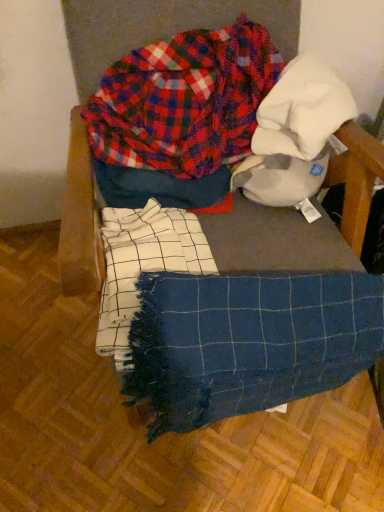
Question: Are plaid fabric at upper center and blue woven blanket at center located far from each other?

Choices:
 (A) yes
 (B) no

Answer: (B)

Question: Is plaid fabric at upper center surrounding blue woven blanket at center?

Choices:
 (A) yes
 (B) no

Answer: (B)

Question: From a real-world perspective, is plaid fabric at upper center beneath blue woven blanket at center?

Choices:
 (A) yes
 (B) no

Answer: (B)

Question: Considering the relative sizes of plaid fabric at upper center and blue woven blanket at center in the image provided, is plaid fabric at upper center shorter than blue woven blanket at center?

Choices:
 (A) yes
 (B) no

Answer: (A)

Question: Can you confirm if plaid fabric at upper center is thinner than blue woven blanket at center?

Choices:
 (A) yes
 (B) no

Answer: (A)

Question: Would you say plaid fabric at upper center is to the left or to the right of blue woven blanket at center in the picture?

Choices:
 (A) left
 (B) right

Answer: (A)

Question: In the image, is plaid fabric at upper center positioned in front of or behind blue woven blanket at center?

Choices:
 (A) behind
 (B) front

Answer: (A)

Question: From the image's perspective, is plaid fabric at upper center positioned above or below blue woven blanket at center?

Choices:
 (A) above
 (B) below

Answer: (A)

Question: Considering the positions of plaid fabric at upper center and blue woven blanket at center in the image, is plaid fabric at upper center wider or thinner than blue woven blanket at center?

Choices:
 (A) thin
 (B) wide

Answer: (A)

Question: Is point (92, 145) closer or farther from the camera than point (354, 359)?

Choices:
 (A) closer
 (B) farther

Answer: (B)

Question: From their relative heights in the image, would you say plaid fabric at upper center is taller or shorter than blue woven blanket at center?

Choices:
 (A) tall
 (B) short

Answer: (B)

Question: From a real-world perspective, is plaid fabric at upper center above or below blue woven blanket at center?

Choices:
 (A) above
 (B) below

Answer: (A)

Question: In the image, is plaid fabric at upper center positioned in front of or behind blue woven blanket at center?

Choices:
 (A) front
 (B) behind

Answer: (B)

Question: In terms of width, does blue woven blanket at center look wider or thinner when compared to blue woven blanket at center?

Choices:
 (A) wide
 (B) thin

Answer: (A)

Question: From the image's perspective, is blue woven blanket at center above or below blue woven blanket at center?

Choices:
 (A) below
 (B) above

Answer: (B)